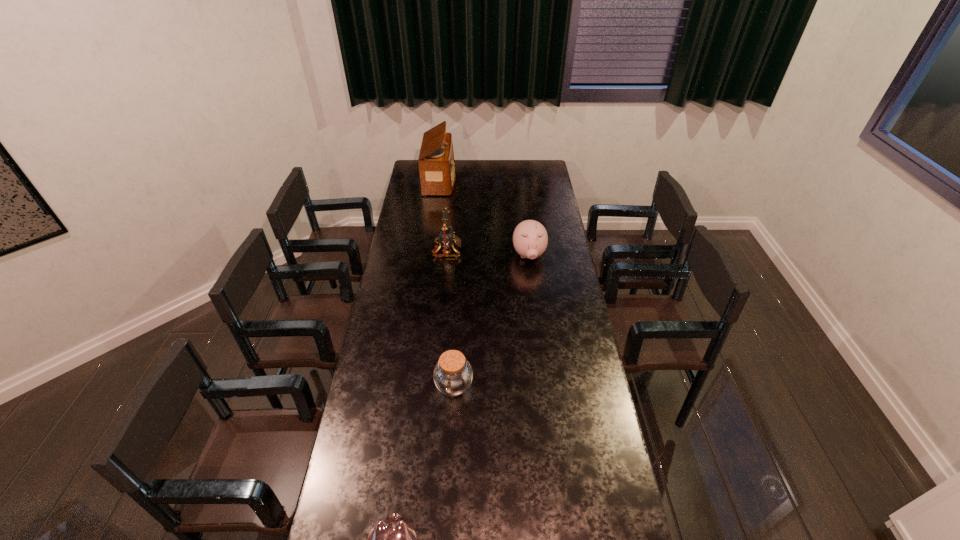
The width and height of the screenshot is (960, 540). In order to click on object positioned at the far edge in this screenshot , I will do `click(436, 163)`.

This screenshot has width=960, height=540. In order to click on object located in the left edge section of the desktop in this screenshot , I will do `click(436, 163)`.

Image resolution: width=960 pixels, height=540 pixels. I want to click on object that is at the right edge, so click(530, 239).

At what (x,y) coordinates should I click in order to perform the action: click on object at the far left corner. Please return your answer as a coordinate pair (x, y). The width and height of the screenshot is (960, 540). Looking at the image, I should click on [436, 163].

The width and height of the screenshot is (960, 540). Identify the location of vacant region at the far edge. (500, 166).

Locate an element on the screen. This screenshot has height=540, width=960. vacant position at the left edge of the desktop is located at coordinates (398, 413).

You are a GUI agent. You are given a task and a screenshot of the screen. Output one action in this format:
    pyautogui.click(x=<x>, y=<y>)
    Task: Click on the vacant space at the right edge
    
    Given the screenshot: What is the action you would take?
    pyautogui.click(x=573, y=454)

In the image, there is a desktop. Identify the location of free space at the far right corner. The width and height of the screenshot is (960, 540). (544, 167).

I want to click on free space between the fourth farthest object and the telephone, so click(x=450, y=318).

Where is `free space between the farther piggy bank and the farthest object`? The height and width of the screenshot is (540, 960). free space between the farther piggy bank and the farthest object is located at coordinates (485, 218).